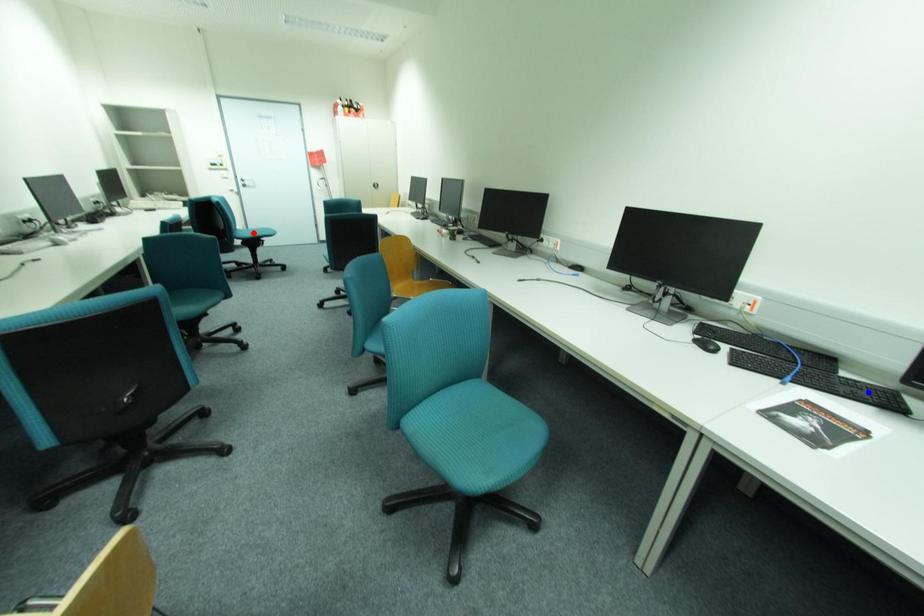
Question: In the image, two points are highlighted. Which point is nearer to the camera? Reply with the corresponding letter.

Choices:
 (A) blue point
 (B) red point

Answer: (A)